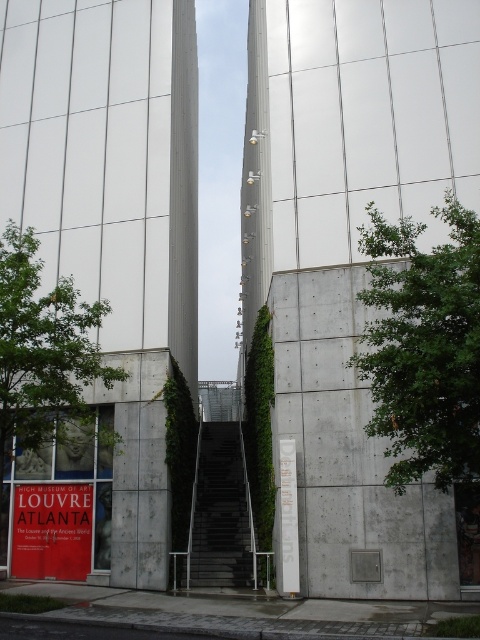
You are an architect visiting the High Museum of Art in Atlanta. You notice the smooth concrete tower at center and the black metal stairs at center. From your vantage point, which object is positioned more to the left?

The black metal stairs at center are positioned more to the left since the smooth concrete tower at center is to the right of them according to the description.

You are a visitor approaching the entrance of the High Museum of Art. You see the smooth concrete tower at center and the red paper sign at lower left. Which object is closer to you as you approach the entrance?

The red paper sign at lower left is closer to you because the smooth concrete tower at center is positioned over it, indicating it is further away.